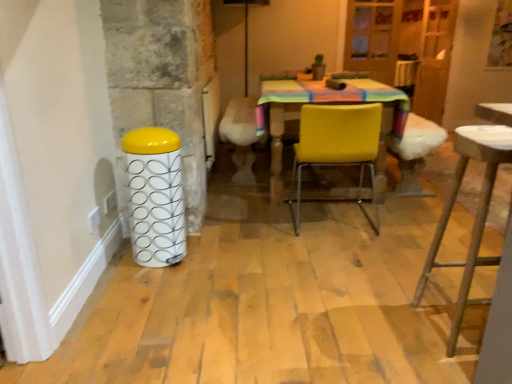
The height and width of the screenshot is (384, 512). I want to click on blank space to the left of metallic stool at right, so pyautogui.click(x=395, y=333).